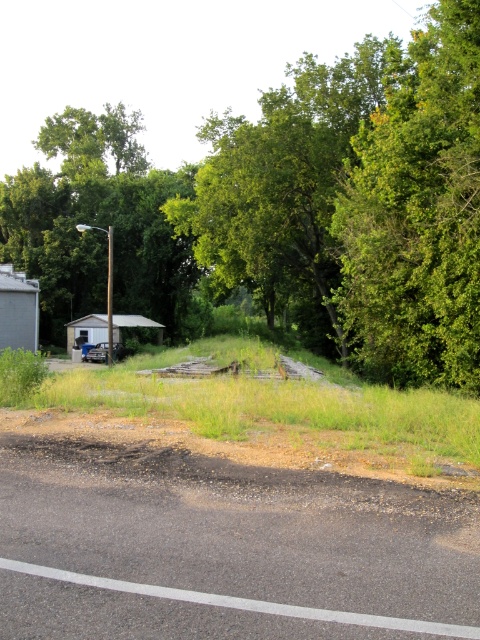
Question: Does green leafy tree at upper right have a smaller size compared to rusty metal trailer at center?

Choices:
 (A) no
 (B) yes

Answer: (A)

Question: Does green leafy tree at upper center appear under rusty metal trailer at center?

Choices:
 (A) yes
 (B) no

Answer: (B)

Question: Estimate the real-world distances between objects in this image. Which object is farther from the green leafy tree at upper center?

Choices:
 (A) green leafy tree at upper right
 (B) rusty metal trailer at center

Answer: (B)

Question: Among these objects, which one is farthest from the camera?

Choices:
 (A) green leafy tree at upper center
 (B) rusty metal trailer at center
 (C) green leafy tree at upper right

Answer: (B)

Question: Which of the following is the farthest from the observer?

Choices:
 (A) (84, 355)
 (B) (382, 168)

Answer: (A)

Question: Can you confirm if green leafy tree at upper right is wider than rusty metal trailer at center?

Choices:
 (A) yes
 (B) no

Answer: (A)